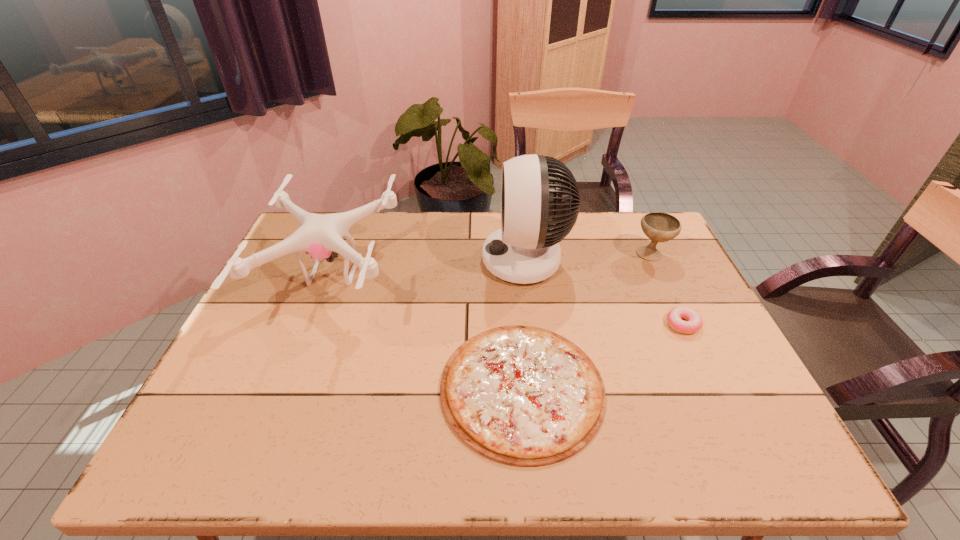
The image size is (960, 540). I want to click on the tallest object, so click(538, 211).

The width and height of the screenshot is (960, 540). I want to click on the second tallest object, so click(x=320, y=235).

This screenshot has height=540, width=960. In order to click on the leftmost object in this screenshot , I will do 320,235.

This screenshot has height=540, width=960. I want to click on chalice, so click(659, 227).

Where is `doughnut`? doughnut is located at coordinates (x=694, y=322).

Identify the location of the shortest object. (524, 396).

Find the location of a particular element. free space located on the grille of the tallest object is located at coordinates (377, 260).

Image resolution: width=960 pixels, height=540 pixels. I want to click on vacant space located on the grille of the tallest object, so click(x=452, y=260).

Locate an element on the screen. The image size is (960, 540). free spot located 0.260m on the grille of the tallest object is located at coordinates (397, 260).

Image resolution: width=960 pixels, height=540 pixels. I want to click on free region located on the top of the drone, so click(503, 274).